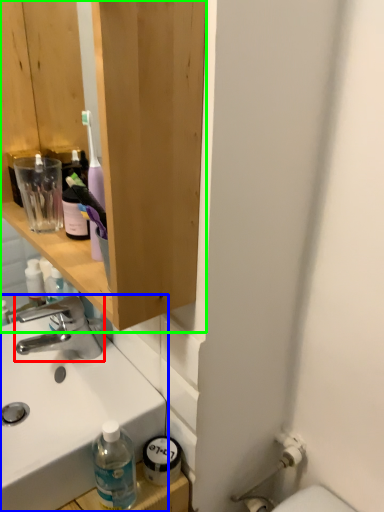
Question: Which is nearer to the tap (highlighted by a red box)? sink (highlighted by a blue box) or bathroom cabinet (highlighted by a green box).

Choices:
 (A) sink
 (B) bathroom cabinet

Answer: (A)